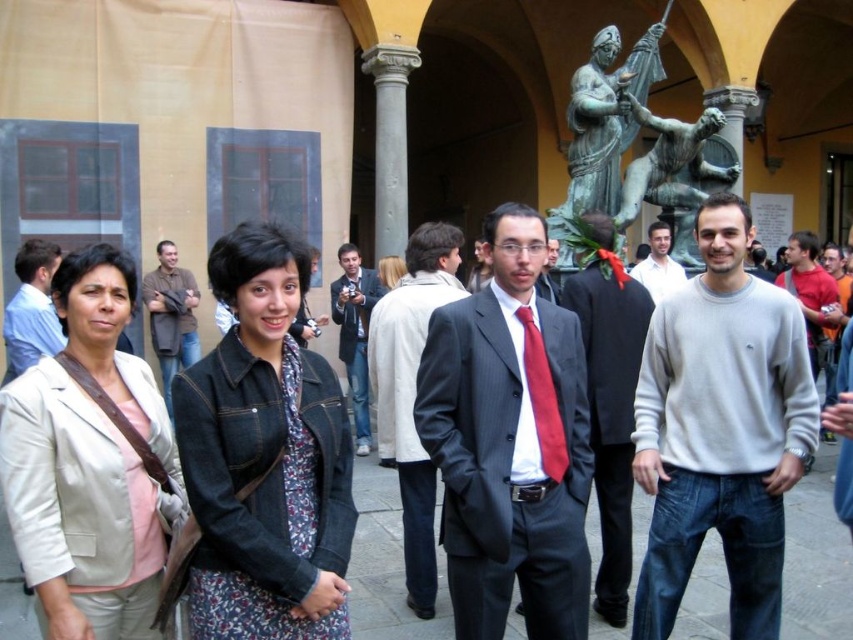
Question: Observing the image, what is the correct spatial positioning of matte gray sweater at center in reference to bronze statue at upper center?

Choices:
 (A) above
 (B) below

Answer: (B)

Question: Which object is farther from the camera taking this photo?

Choices:
 (A) red cotton sweater at right
 (B) matte black suit at center
 (C) brown leather jacket at left

Answer: (C)

Question: Can you confirm if dark gray suit at center is bigger than blue denim jeans at center?

Choices:
 (A) no
 (B) yes

Answer: (B)

Question: Can you confirm if denim jacket at center is wider than matte gray sweater at center?

Choices:
 (A) yes
 (B) no

Answer: (B)

Question: Which of these objects is positioned farthest from the denim jacket at center?

Choices:
 (A) beige fabric jacket at left
 (B) gray sweater at center
 (C) matte black suit at center

Answer: (B)

Question: Which object appears farthest from the camera in this image?

Choices:
 (A) red cotton sweater at right
 (B) light beige jacket at lower left
 (C) matte gray sweater at center
 (D) denim jacket at center

Answer: (B)